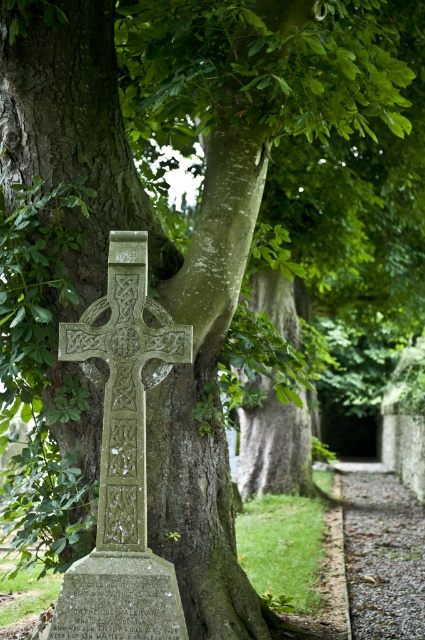
Question: Does green stone cross at center have a smaller size compared to gravel path at lower center?

Choices:
 (A) yes
 (B) no

Answer: (B)

Question: Which object is closer to the camera taking this photo?

Choices:
 (A) green stone cross at center
 (B) gravel path at lower center
 (C) granite gravestone at center

Answer: (C)

Question: Which object appears closest to the camera in this image?

Choices:
 (A) green stone cross at center
 (B) granite gravestone at center
 (C) gravel path at lower center

Answer: (B)

Question: Does green stone cross at center have a lesser width compared to granite gravestone at center?

Choices:
 (A) no
 (B) yes

Answer: (B)

Question: Does green stone cross at center appear on the right side of granite gravestone at center?

Choices:
 (A) no
 (B) yes

Answer: (B)

Question: Which object is the closest to the granite gravestone at center?

Choices:
 (A) gravel path at lower center
 (B) green stone cross at center

Answer: (B)